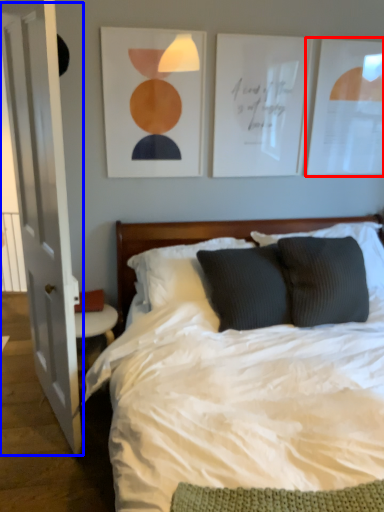
Question: Among these objects, which one is farthest to the camera, picture frame (highlighted by a red box) or glass door (highlighted by a blue box)?

Choices:
 (A) picture frame
 (B) glass door

Answer: (A)